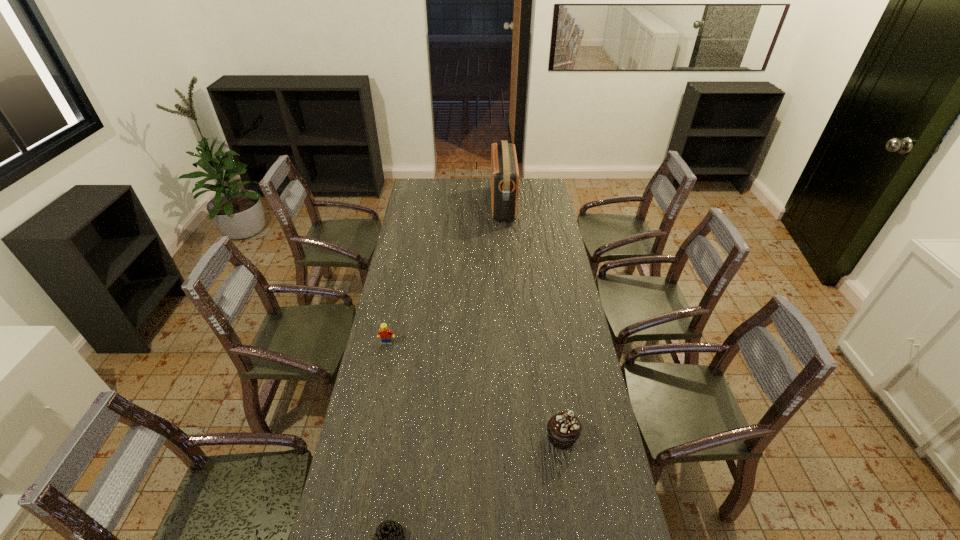
The width and height of the screenshot is (960, 540). I want to click on blank region between the third farthest object and the leftmost object, so click(x=474, y=390).

In order to click on free space between the second nearest object and the leftmost object in this screenshot , I will do `click(474, 390)`.

Image resolution: width=960 pixels, height=540 pixels. Identify the location of vacant space that's between the radio receiver and the third nearest object. (444, 274).

This screenshot has width=960, height=540. I want to click on the second closest object to the farthest object, so click(x=564, y=428).

Identify which object is located as the second nearest to the farthest object. Please provide its 2D coordinates. Your answer should be formatted as a tuple, i.e. [(x, y)], where the tuple contains the x and y coordinates of a point satisfying the conditions above.

[(564, 428)]

At what (x,y) coordinates should I click in order to perform the action: click on free region that satisfies the following two spatial constraints: 1. on the front-facing side of the cupcake; 2. on the left side of the third nearest object. Please return your answer as a coordinate pair (x, y). The height and width of the screenshot is (540, 960). Looking at the image, I should click on (368, 437).

Where is `free space that satisfies the following two spatial constraints: 1. on the front-facing side of the third object from left to right; 2. on the back side of the rightmost object`? This screenshot has width=960, height=540. free space that satisfies the following two spatial constraints: 1. on the front-facing side of the third object from left to right; 2. on the back side of the rightmost object is located at coordinates (519, 437).

Locate an element on the screen. This screenshot has width=960, height=540. free point that satisfies the following two spatial constraints: 1. on the back side of the second nearest object; 2. on the front-facing side of the second object from right to left is located at coordinates (527, 205).

The width and height of the screenshot is (960, 540). Identify the location of vacant space that satisfies the following two spatial constraints: 1. on the front-facing side of the cupcake; 2. on the right side of the leftmost object. (368, 437).

Find the location of a particular element. vacant space that satisfies the following two spatial constraints: 1. on the front-facing side of the third object from left to right; 2. on the front-facing side of the Lego is located at coordinates (513, 343).